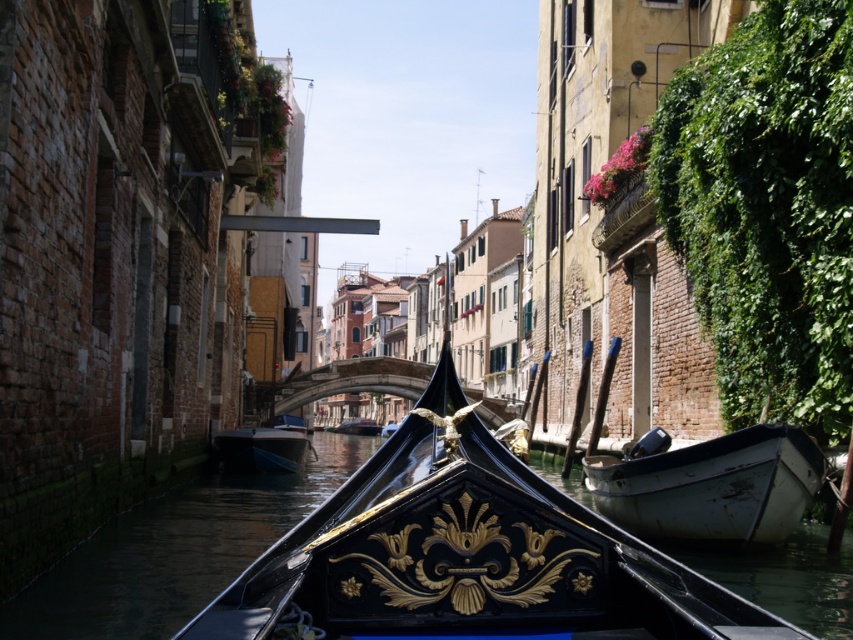
Question: Does rusty metal dinghy at lower right appear under blue glossy boat at center?

Choices:
 (A) no
 (B) yes

Answer: (A)

Question: Estimate the real-world distances between objects in this image. Which object is farther from the rusty metal dinghy at lower right?

Choices:
 (A) black polished wood boat at center
 (B) black polished wood gondola at center
 (C) blue glossy boat at center

Answer: (A)

Question: Is rusty metal dinghy at lower right bigger than blue glossy boat at center?

Choices:
 (A) no
 (B) yes

Answer: (A)

Question: Which point is farther from the camera taking this photo?

Choices:
 (A) (251, 448)
 (B) (456, 422)
 (C) (361, 420)
 (D) (671, 454)

Answer: (C)

Question: Is rusty metal dinghy at lower right closer to the viewer compared to blue glossy boat at center?

Choices:
 (A) yes
 (B) no

Answer: (A)

Question: Considering the real-world distances, which object is closest to the blue glossy boat at center?

Choices:
 (A) black polished wood boat at center
 (B) rusty metal dinghy at lower right

Answer: (B)